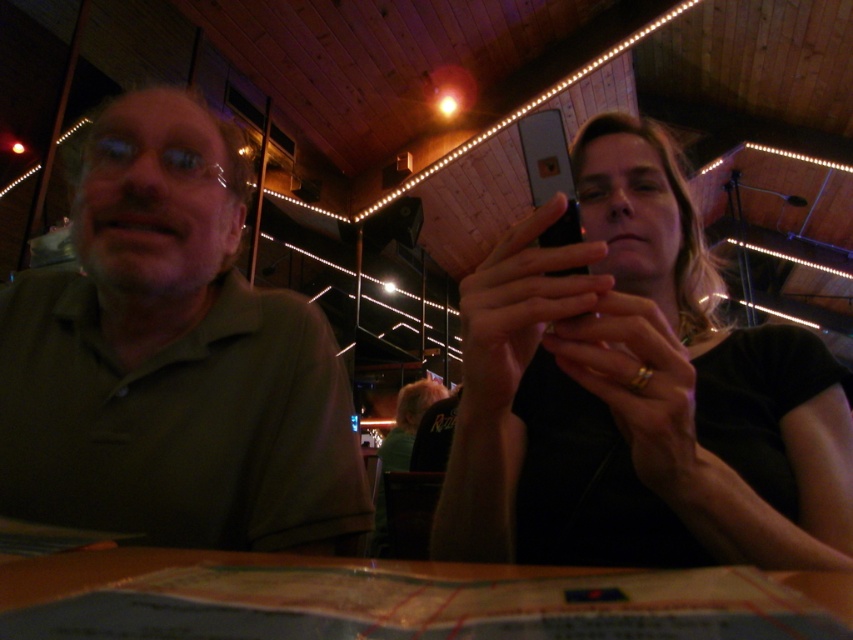
In the scene shown: Does green matte shirt at left have a greater width compared to wooden table at center?

Yes.

Who is more forward, (163,524) or (18,620)?

Point (18,620) is in front.

The height and width of the screenshot is (640, 853). Describe the element at coordinates (173, 360) in the screenshot. I see `green matte shirt at left` at that location.

Find the location of a particular element. The width and height of the screenshot is (853, 640). green matte shirt at left is located at coordinates (173, 360).

Can you confirm if black matte phone at upper right is smaller than wooden table at center?

No, black matte phone at upper right is not smaller than wooden table at center.

What do you see at coordinates (637, 394) in the screenshot?
I see `black matte phone at upper right` at bounding box center [637, 394].

This screenshot has width=853, height=640. I want to click on black matte phone at upper right, so (x=637, y=394).

Is black matte phone at upper right wider than green matte shirt at left?

No, black matte phone at upper right is not wider than green matte shirt at left.

Between black matte phone at upper right and green matte shirt at left, which one is positioned higher?

black matte phone at upper right is higher up.

Between point (757, 404) and point (312, 362), which one is positioned in front?

Point (757, 404) is in front.

Image resolution: width=853 pixels, height=640 pixels. What are the coordinates of `black matte phone at upper right` in the screenshot? It's located at (637, 394).